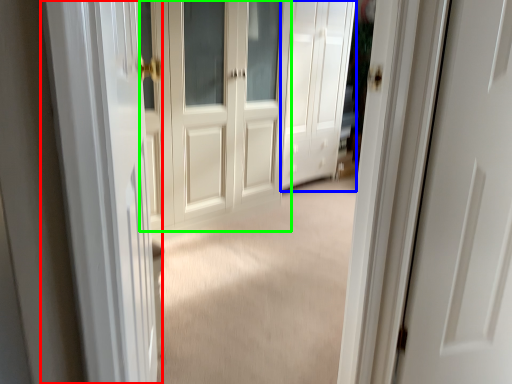
Question: Which is nearer to the screen door (highlighted by a red box)? door (highlighted by a blue box) or door (highlighted by a green box).

Choices:
 (A) door
 (B) door

Answer: (B)